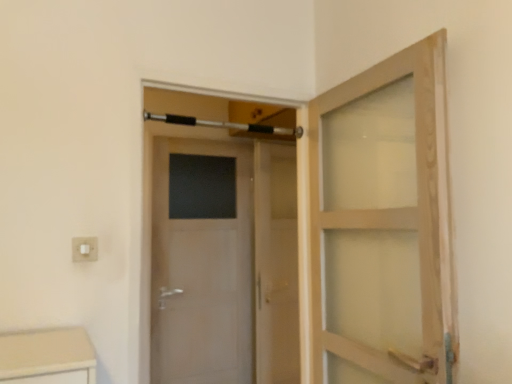
Question: Is white plastic electric outlet at lower left to the right of clear glass screen door at center from the viewer's perspective?

Choices:
 (A) yes
 (B) no

Answer: (B)

Question: Does white plastic electric outlet at lower left come behind clear glass screen door at center?

Choices:
 (A) yes
 (B) no

Answer: (B)

Question: Are white plastic electric outlet at lower left and clear glass screen door at center beside each other?

Choices:
 (A) yes
 (B) no

Answer: (B)

Question: Is white plastic electric outlet at lower left shorter than clear glass screen door at center?

Choices:
 (A) no
 (B) yes

Answer: (B)

Question: Is white plastic electric outlet at lower left taller than clear glass screen door at center?

Choices:
 (A) no
 (B) yes

Answer: (A)

Question: Considering their positions, is white glossy door at center located in front of or behind silver metallic towel bar at upper center?

Choices:
 (A) front
 (B) behind

Answer: (A)

Question: Looking at their shapes, would you say white glossy door at center is wider or thinner than silver metallic towel bar at upper center?

Choices:
 (A) thin
 (B) wide

Answer: (B)

Question: Based on their positions, is white glossy door at center located to the left or right of silver metallic towel bar at upper center?

Choices:
 (A) right
 (B) left

Answer: (A)

Question: Does point (293, 380) appear closer or farther from the camera than point (144, 117)?

Choices:
 (A) farther
 (B) closer

Answer: (A)

Question: Based on their sizes in the image, would you say white plastic electric outlet at lower left is bigger or smaller than white glossy door at center?

Choices:
 (A) small
 (B) big

Answer: (A)

Question: From a real-world perspective, is white plastic electric outlet at lower left above or below white glossy door at center?

Choices:
 (A) above
 (B) below

Answer: (A)

Question: Looking at their shapes, would you say white plastic electric outlet at lower left is wider or thinner than white glossy door at center?

Choices:
 (A) thin
 (B) wide

Answer: (A)

Question: From the image's perspective, is white plastic electric outlet at lower left positioned above or below white glossy door at center?

Choices:
 (A) above
 (B) below

Answer: (A)

Question: In terms of size, does clear glass screen door at center appear bigger or smaller than white glossy door at center?

Choices:
 (A) big
 (B) small

Answer: (B)

Question: From the image's perspective, is clear glass screen door at center positioned above or below white glossy door at center?

Choices:
 (A) above
 (B) below

Answer: (B)